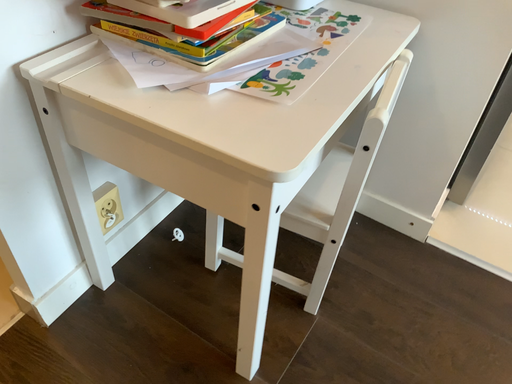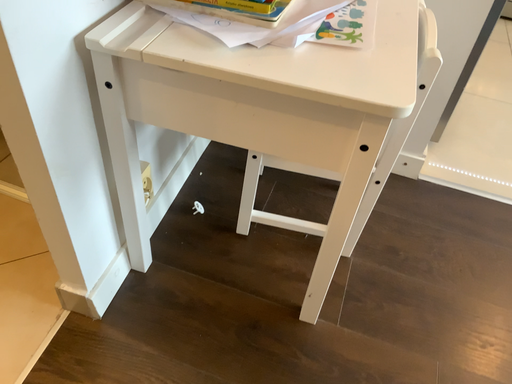
Question: Which way did the camera rotate in the video?

Choices:
 (A) rotated right
 (B) rotated left

Answer: (A)